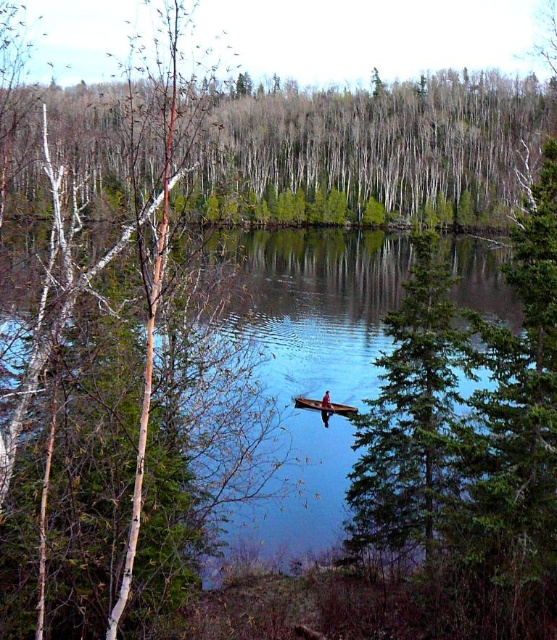
Question: Which of the following is the closest to the observer?

Choices:
 (A) wooden canoe at center
 (B) brown wooden canoe at center
 (C) green leafy trees at upper center

Answer: (C)

Question: Is green leafy trees at upper center below wooden canoe at center?

Choices:
 (A) yes
 (B) no

Answer: (B)

Question: Can you confirm if green leafy trees at upper center is bigger than wooden canoe at center?

Choices:
 (A) yes
 (B) no

Answer: (A)

Question: Which of the following is the farthest from the observer?

Choices:
 (A) (324, 401)
 (B) (319, 131)

Answer: (B)

Question: Which object is positioned closest to the green leafy trees at upper center?

Choices:
 (A) clear blue water at center
 (B) brown wooden canoe at center

Answer: (A)

Question: From the image, what is the correct spatial relationship of green leafy trees at upper center in relation to clear blue water at center?

Choices:
 (A) above
 (B) below

Answer: (A)